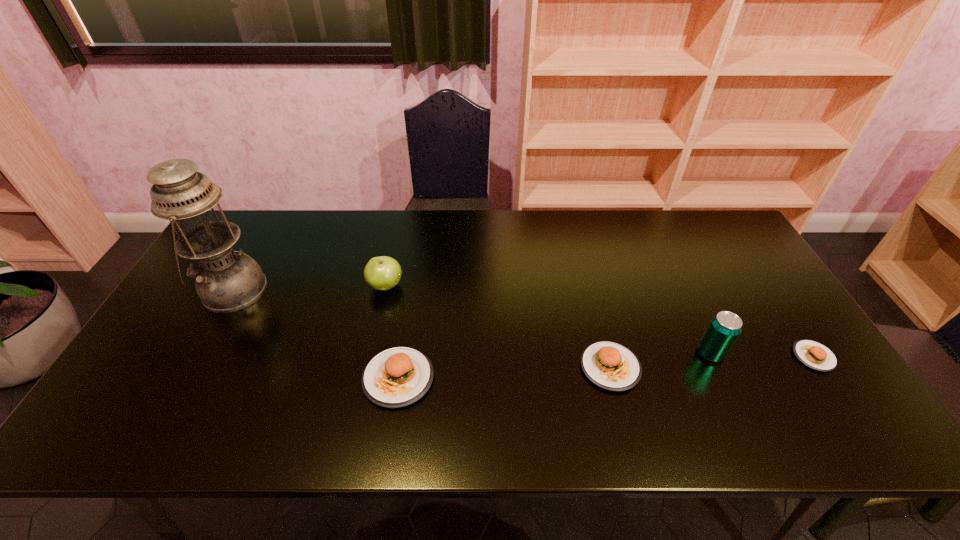
In the image, there is a desktop. At what (x,y) coordinates should I click in order to perform the action: click on vacant space at the left edge. Please return your answer as a coordinate pair (x, y). Image resolution: width=960 pixels, height=540 pixels. Looking at the image, I should click on (200, 315).

Locate an element on the screen. free point at the far left corner is located at coordinates (272, 217).

At what (x,y) coordinates should I click in order to perform the action: click on vacant space at the far right corner of the desktop. Please return your answer as a coordinate pair (x, y). Looking at the image, I should click on (709, 217).

Locate an element on the screen. This screenshot has width=960, height=540. free space between the fourth object from left to right and the apple is located at coordinates (498, 327).

At what (x,y) coordinates should I click in order to perform the action: click on vacant region between the second tallest food and the leftmost food. Please return your answer as a coordinate pair (x, y). This screenshot has width=960, height=540. Looking at the image, I should click on (504, 373).

You are a GUI agent. You are given a task and a screenshot of the screen. Output one action in this format:
    pyautogui.click(x=<x>, y=<y>)
    Task: Click on the blank region between the apple and the oil lamp
    Image resolution: width=960 pixels, height=540 pixels.
    Given the screenshot: What is the action you would take?
    pyautogui.click(x=309, y=288)

Locate an element on the screen. The image size is (960, 540). unoccupied area between the second tallest food and the leftmost food is located at coordinates (504, 373).

Find the location of a particular element. free space between the apple and the leftmost food is located at coordinates (392, 332).

Where is `free space between the shortest food and the second food from right to left`? free space between the shortest food and the second food from right to left is located at coordinates (712, 362).

Locate an element on the screen. vacant region between the second tallest food and the leftmost object is located at coordinates (421, 329).